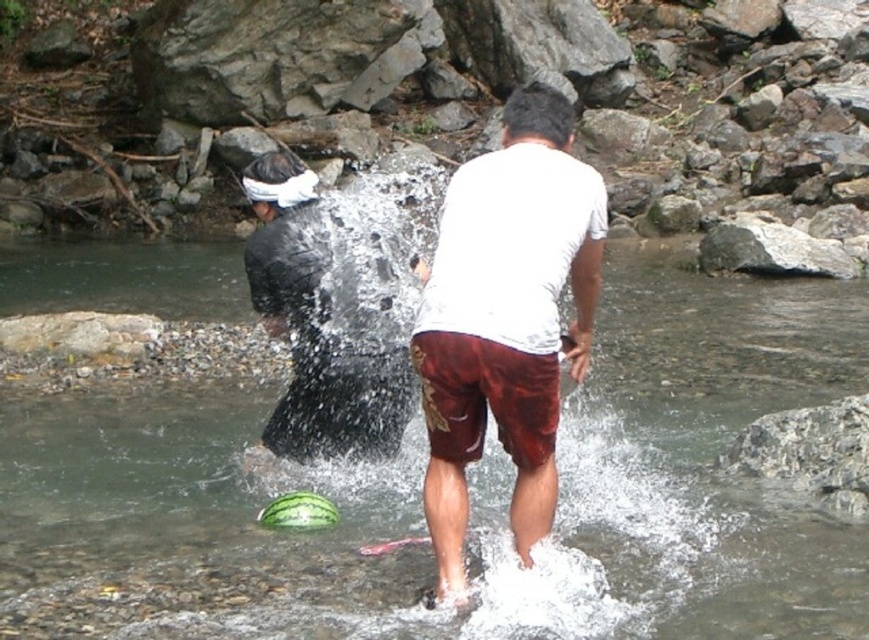
You are a drone operator trying to capture the best aerial shot of the clear water stream at center. The drone has a GPS coordinate system where the bottom left corner is the origin point. The stream is located at coordinate point 0.770, 0.542. To ensure the stream is centered in the frame, where should you position the drone relative to the stream?

The clear water stream at center is already positioned at point (469,492) in the GPS coordinate system, so the drone should be placed directly above this coordinate to center the stream in the frame.